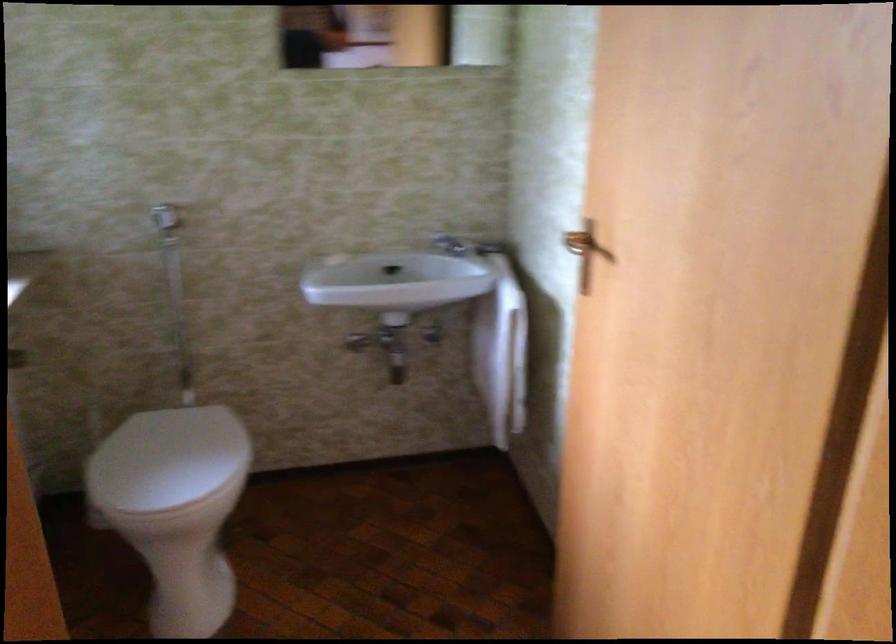
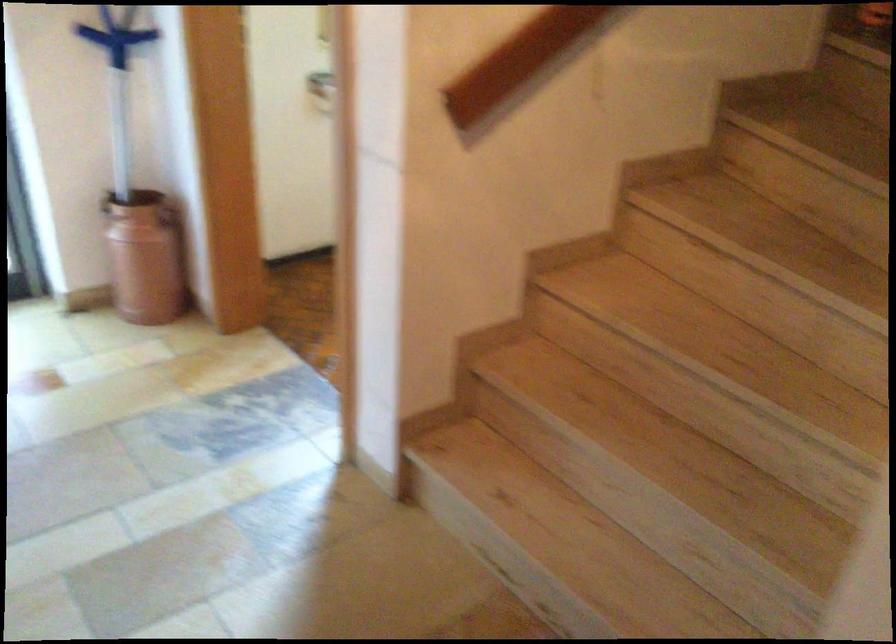
Question: I am providing you with two images of the same scene from different viewpoints. After the viewpoint changes to image2, which objects are now occluded?

Choices:
 (A) container handle
 (B) acrylic sign holder
 (C) faucet handle
 (D) wooden stair handrail

Answer: (C)